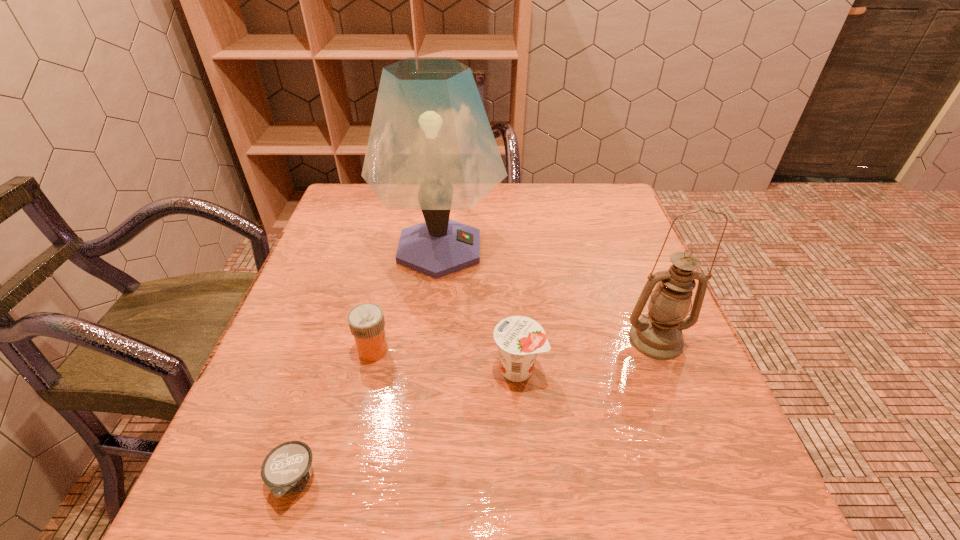
Find the location of a particular element. free space in the image that satisfies the following two spatial constraints: 1. on the base of the rightmost object; 2. on the right side of the farthest object is located at coordinates (429, 340).

The height and width of the screenshot is (540, 960). I want to click on free region that satisfies the following two spatial constraints: 1. on the base of the farthest object; 2. on the left side of the taller yogurt, so pyautogui.click(x=426, y=369).

Where is `free spot that satisfies the following two spatial constraints: 1. on the label side of the medicine; 2. on the left side of the farther yogurt`? This screenshot has width=960, height=540. free spot that satisfies the following two spatial constraints: 1. on the label side of the medicine; 2. on the left side of the farther yogurt is located at coordinates (369, 369).

This screenshot has height=540, width=960. I want to click on vacant region that satisfies the following two spatial constraints: 1. on the back side of the rightmost object; 2. on the right side of the farther yogurt, so [x=516, y=340].

In order to click on free space that satisfies the following two spatial constraints: 1. on the base of the lampshade; 2. on the right side of the right yogurt in this screenshot , I will do `click(426, 369)`.

Image resolution: width=960 pixels, height=540 pixels. I want to click on free space that satisfies the following two spatial constraints: 1. on the label side of the taller yogurt; 2. on the right side of the medicine, so click(369, 369).